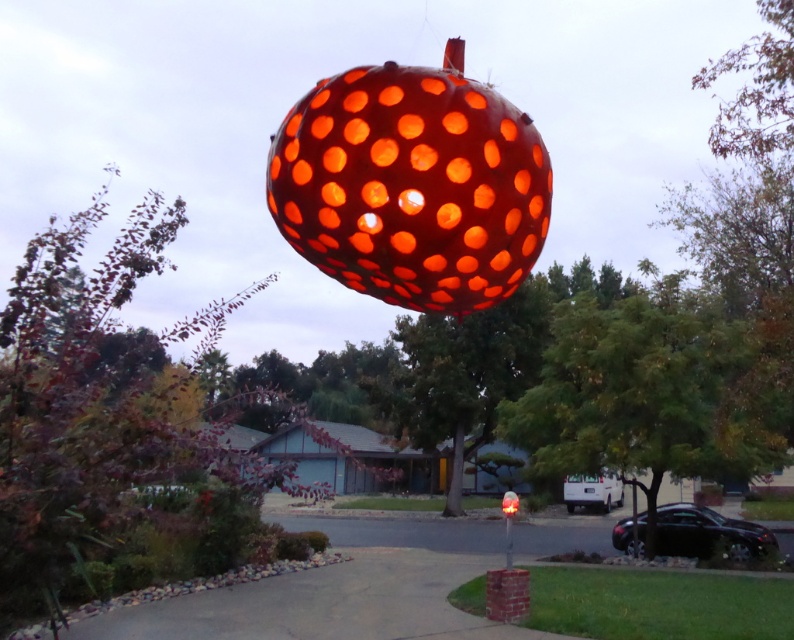
How much distance is there between green leafy tree at upper center and green leafy tree at center?

A distance of 11.13 meters exists between green leafy tree at upper center and green leafy tree at center.

Does point (139, 506) come farther from viewer compared to point (600, 305)?

No, (139, 506) is in front of (600, 305).

From the picture: Measure the distance between green leafy tree at upper center and camera.

green leafy tree at upper center is 4.87 meters away from camera.

The width and height of the screenshot is (794, 640). Find the location of `green leafy tree at upper center`. green leafy tree at upper center is located at coordinates (114, 429).

Between point (147, 417) and point (476, 273), which one is positioned behind?

The point (147, 417) is behind.

Who is higher up, green leafy tree at upper center or translucent orange sphere at center?

translucent orange sphere at center is higher up.

Which is in front, point (118, 468) or point (441, 97)?

Point (441, 97) is more forward.

Find the location of a particular element. Image resolution: width=794 pixels, height=640 pixels. green leafy tree at upper center is located at coordinates (114, 429).

Is translucent orange sphere at center further to the viewer compared to green leafy tree at center?

No, it is not.

Does translucent orange sphere at center appear over green leafy tree at center?

Result: Indeed, translucent orange sphere at center is positioned over green leafy tree at center.

You are a GUI agent. You are given a task and a screenshot of the screen. Output one action in this format:
    pyautogui.click(x=<x>, y=<y>)
    Task: Click on the translucent orange sphere at center
    The height and width of the screenshot is (640, 794).
    Given the screenshot: What is the action you would take?
    pyautogui.click(x=411, y=186)

Locate an element on the screen. The height and width of the screenshot is (640, 794). translucent orange sphere at center is located at coordinates (411, 186).